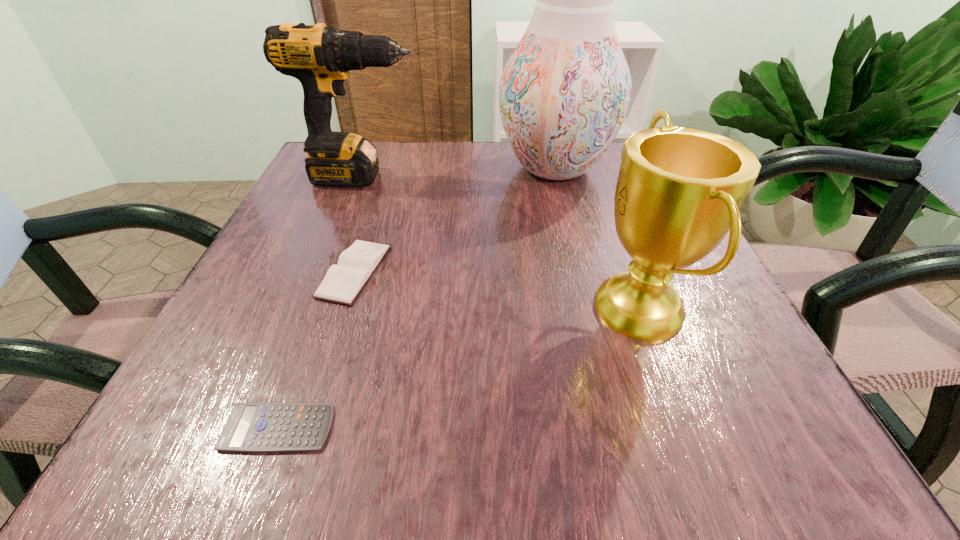
Where is `vacant space located on the shiny surface of the award`? vacant space located on the shiny surface of the award is located at coordinates (423, 309).

At what (x,y) coordinates should I click in order to perform the action: click on free space located 0.310m on the back of the diary. Please return your answer as a coordinate pair (x, y). The width and height of the screenshot is (960, 540). Looking at the image, I should click on (391, 159).

The width and height of the screenshot is (960, 540). Identify the location of vacant space positioned 0.180m on the back of the calculator. (325, 301).

Locate an element on the screen. This screenshot has width=960, height=540. vase that is at the far edge is located at coordinates (564, 93).

I want to click on drill situated at the far edge, so click(320, 57).

You are a GUI agent. You are given a task and a screenshot of the screen. Output one action in this format:
    pyautogui.click(x=<x>, y=<y>)
    Task: Click on the object positioned at the near edge
    The image size is (960, 540).
    Given the screenshot: What is the action you would take?
    pyautogui.click(x=268, y=426)

In order to click on drill that is at the left edge in this screenshot , I will do `click(320, 57)`.

Where is `diary that is at the left edge`? diary that is at the left edge is located at coordinates (342, 283).

The height and width of the screenshot is (540, 960). Identify the location of calculator at the left edge. (268, 426).

Where is `vase situated at the right edge`? vase situated at the right edge is located at coordinates (564, 93).